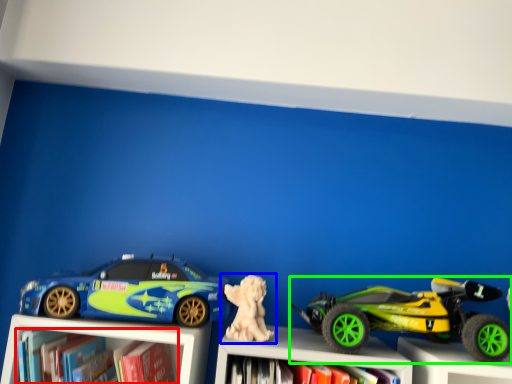
Question: Which is farther away from book (highlighted by a red box)? toy (highlighted by a blue box) or toy (highlighted by a green box)?

Choices:
 (A) toy
 (B) toy

Answer: (B)